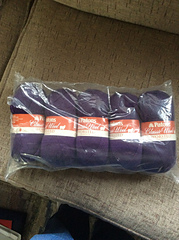
You are a GUI agent. You are given a task and a screenshot of the screen. Output one action in this format:
    pyautogui.click(x=<x>, y=<y>)
    Task: Click on the couch
    
    Given the screenshot: What is the action you would take?
    pyautogui.click(x=113, y=203)